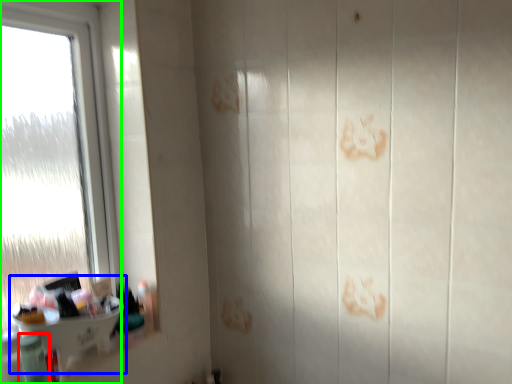
Question: Which object is the closest to the toiletry (highlighted by a red box)? Choose among these: sink (highlighted by a blue box) or window (highlighted by a green box).

Choices:
 (A) sink
 (B) window

Answer: (A)